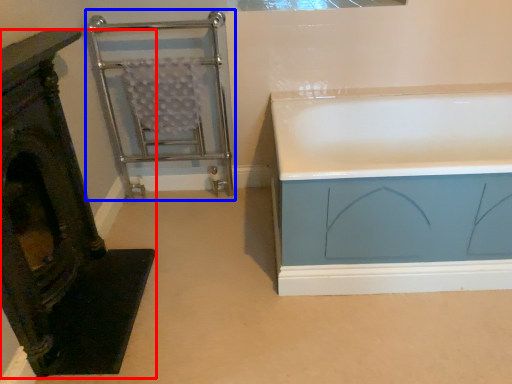
Question: Among these objects, which one is nearest to the camera, furniture (highlighted by a red box) or cage (highlighted by a blue box)?

Choices:
 (A) furniture
 (B) cage

Answer: (A)